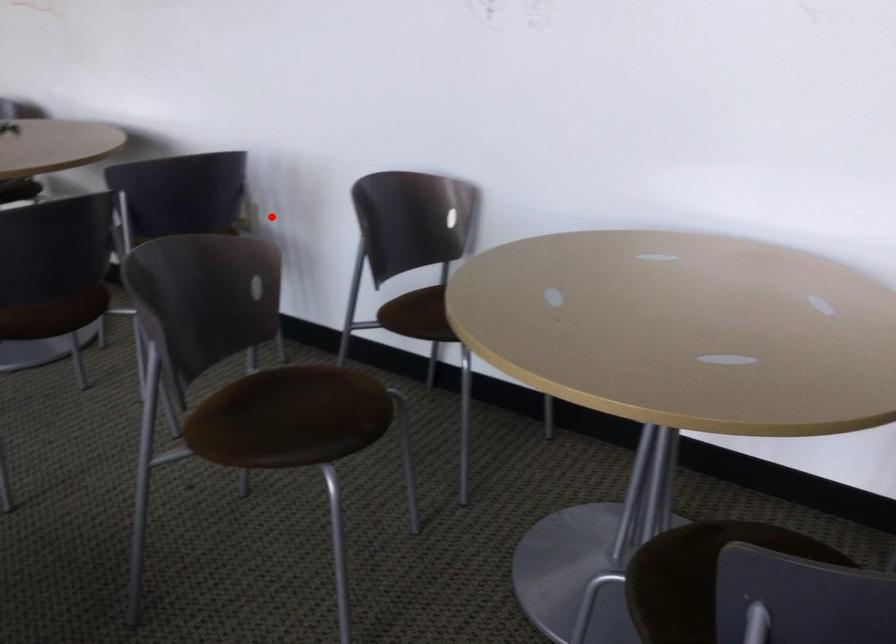
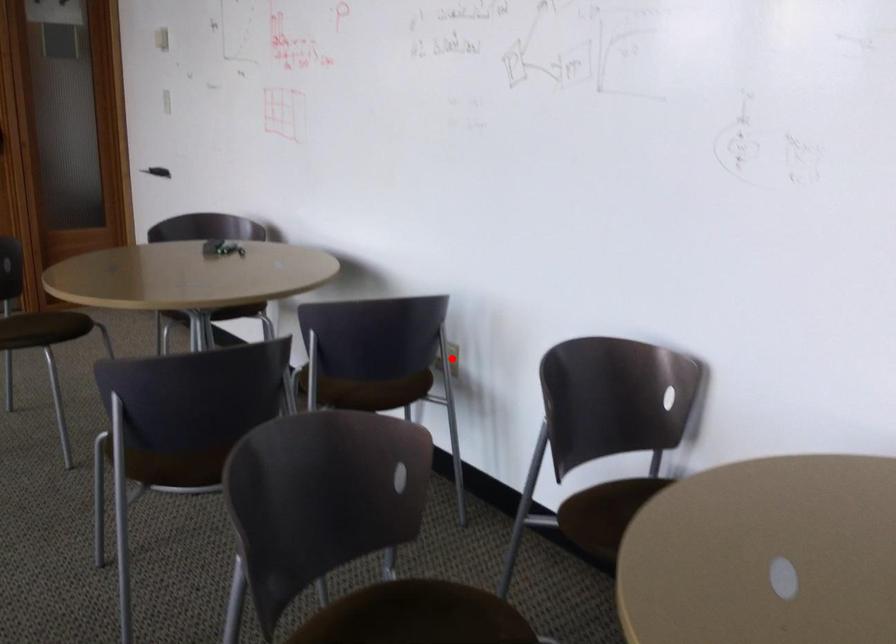
I am providing you with two images of the same scene from different viewpoints. A red point is marked on the first image and another point is marked on the second image. Do the highlighted points in image1 and image2 indicate the same real-world spot?

Yes